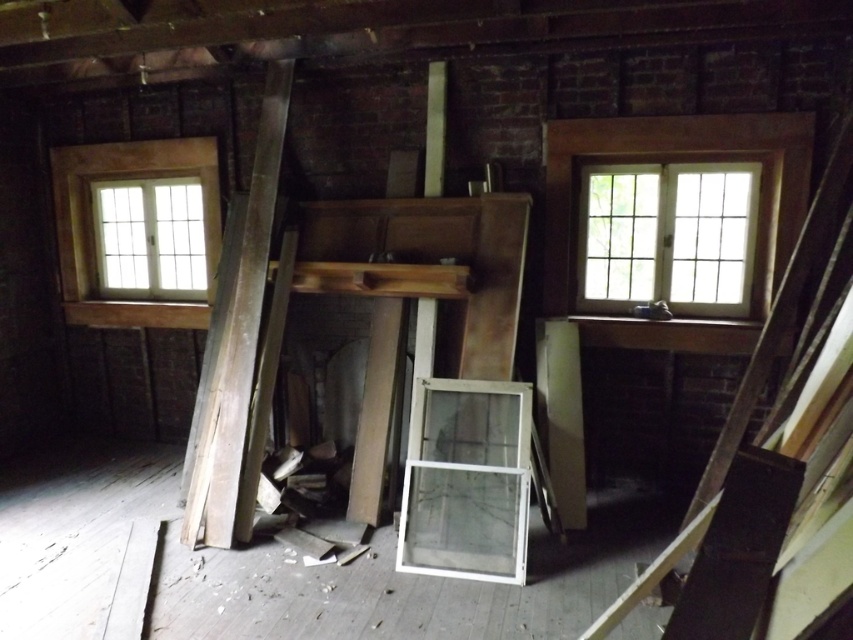
Between wooden at right and clear glass window at left, which one appears on the left side from the viewer's perspective?

clear glass window at left is more to the left.

Does wooden at right appear over clear glass window at left?

No, wooden at right is not above clear glass window at left.

Is point (849, 147) less distant than point (164, 180)?

Yes, it is.

In order to click on wooden at right in this screenshot , I will do `click(750, 452)`.

Between point (675, 252) and point (515, 548), which one is positioned in front?

Point (515, 548)

Is clear glass window at upper right to the right of white glass door at center from the viewer's perspective?

Correct, you'll find clear glass window at upper right to the right of white glass door at center.

This screenshot has height=640, width=853. What are the coordinates of `clear glass window at upper right` in the screenshot? It's located at (668, 236).

Is white glass door at center thinner than weathered wood beam at left?

In fact, white glass door at center might be wider than weathered wood beam at left.

Who is more forward, [453,522] or [221,401]?

Point [453,522]

Who is more forward, (520,529) or (236,472)?

Point (520,529)

Identify the location of white glass door at center. (468, 483).